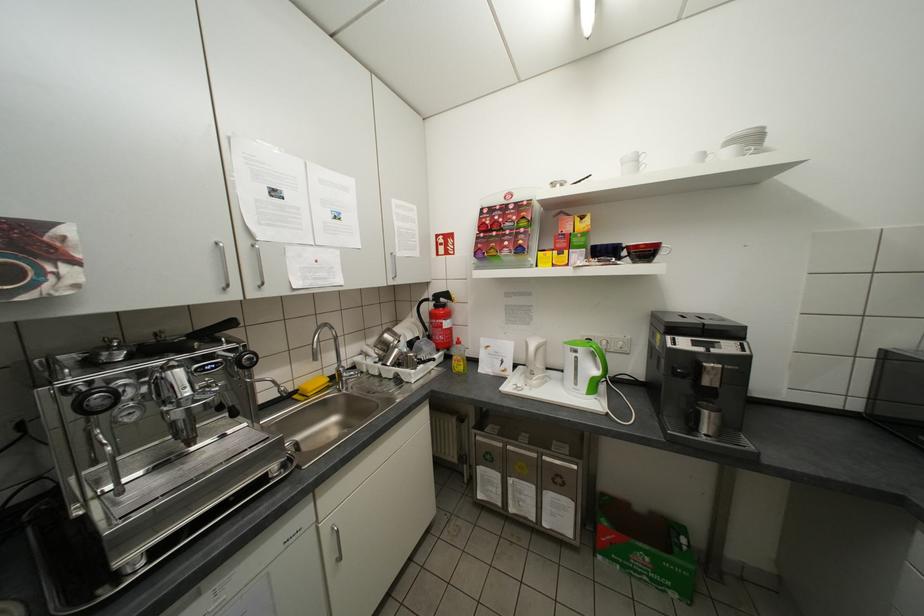
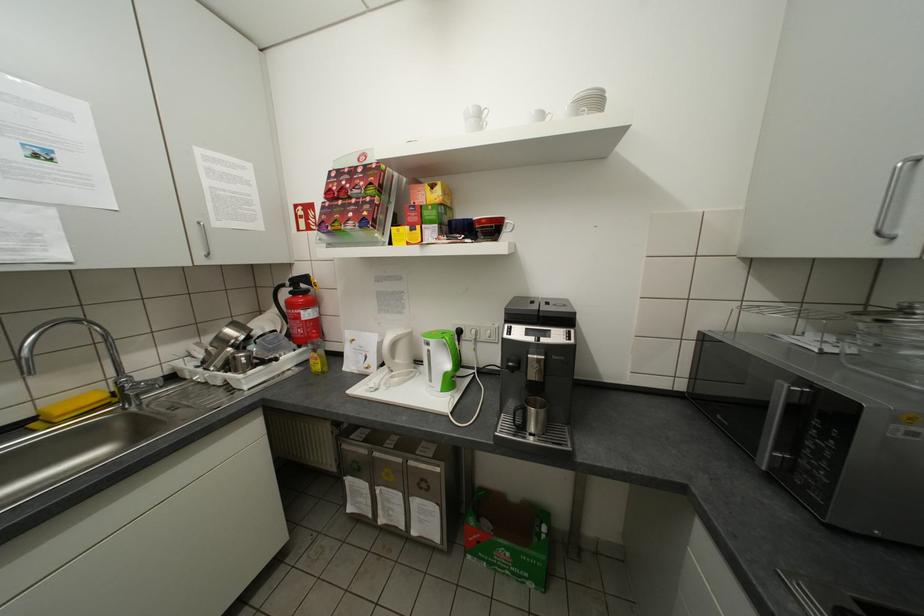
The point at (399, 276) is marked in the first image. Where is the corresponding point in the second image?

(209, 253)